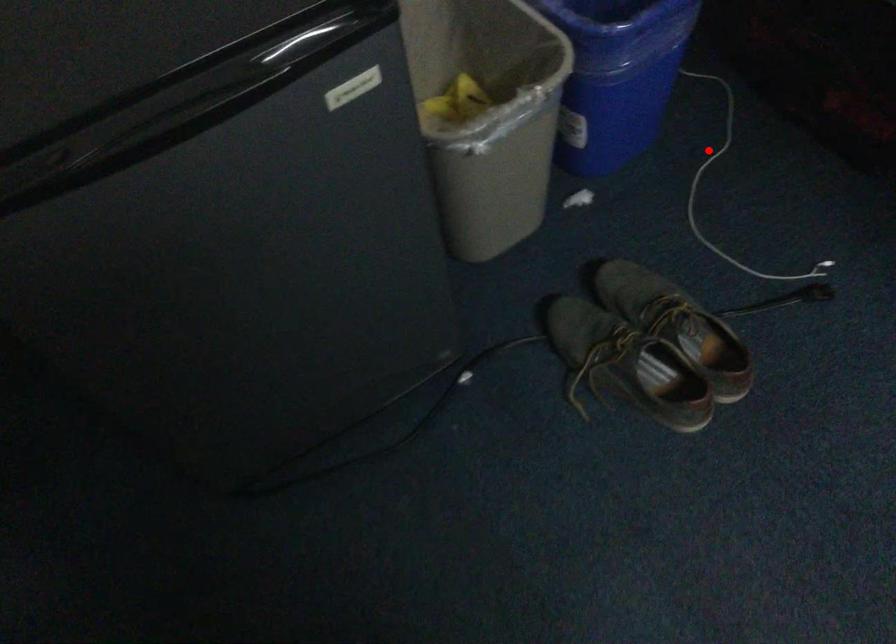
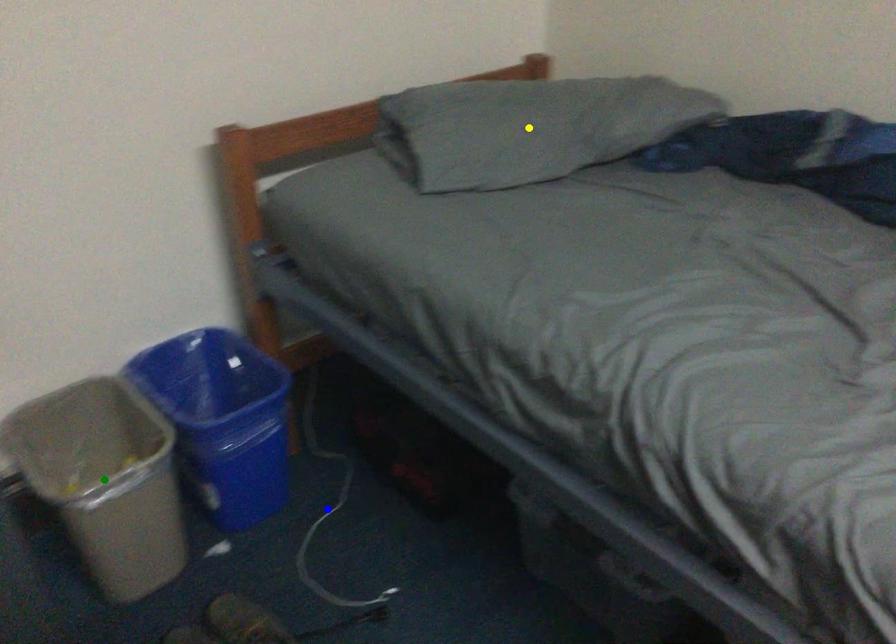
Question: I am providing you with two images of the same scene from different viewpoints. A red point is marked on the first image. You are given multiple points on the second image. In image 2, which mark is for the same physical point as the one in image 1?

Choices:
 (A) green point
 (B) yellow point
 (C) blue point

Answer: (C)